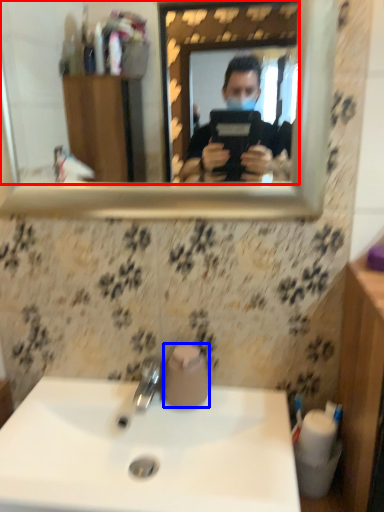
Question: Which point is closer to the camera, mirror (highlighted by a red box) or toilet paper (highlighted by a blue box)?

Choices:
 (A) mirror
 (B) toilet paper

Answer: (A)